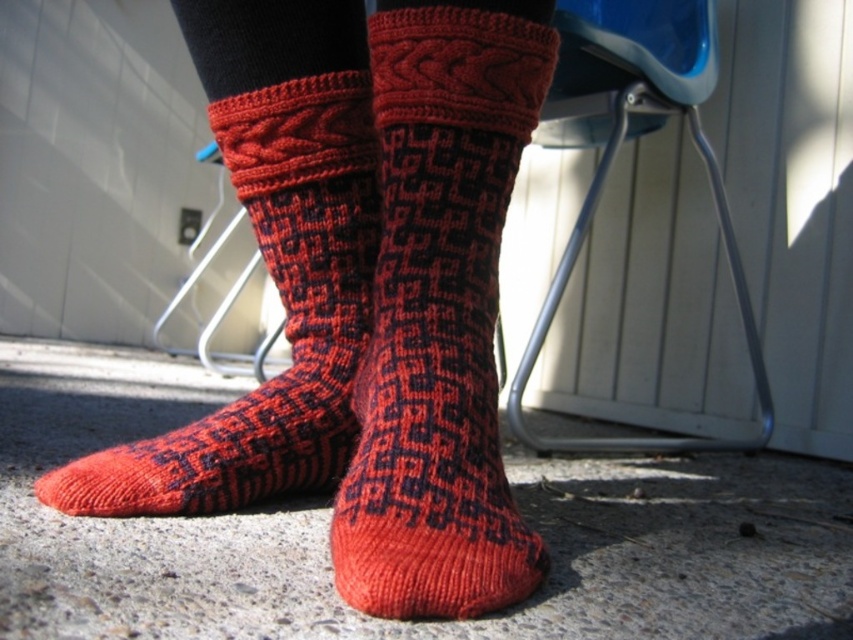
You are a delivery person trying to place a small package between the knitted wool socks at center and the blue plastic chair at center. Can you fit the package there?

The knitted wool socks at center is thinner than the blue plastic chair at center, so there is space between them. The package can be placed there as long as it is smaller than the available space between the two objects.

You are a photographer trying to capture the knitted wool socks at center in the image. If the camera is focused on the blue chair with metal legs in the background, will the socks be in focus?

Answer: The knitted wool socks at center are positioned at point (439, 312), which is not the same as the blue chair with metal legs in the background. Therefore, the socks may not be in focus if the camera is focused on the chair.

You are a tailor trying to match a pair of socks for a customer. You have two options in front of you, the knitted wool socks at center and the knitted woolen sock at center. Which one is bigger?

The knitted wool socks at center is larger in size than the knitted woolen sock at center.